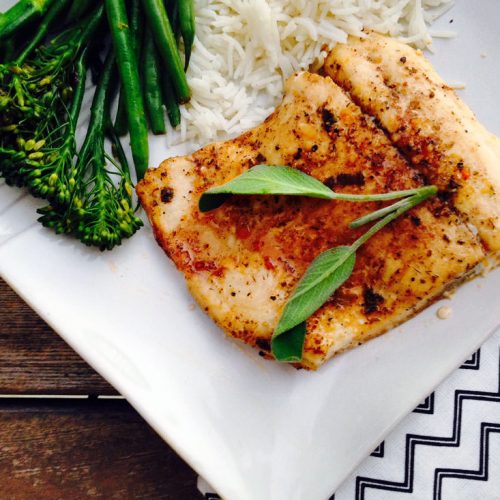
At what (x,y) coordinates should I click in order to perform the action: click on drop of sauce on white square dinner plate. Please return your answer as a coordinate pair (x, y). Looking at the image, I should click on (445, 307).